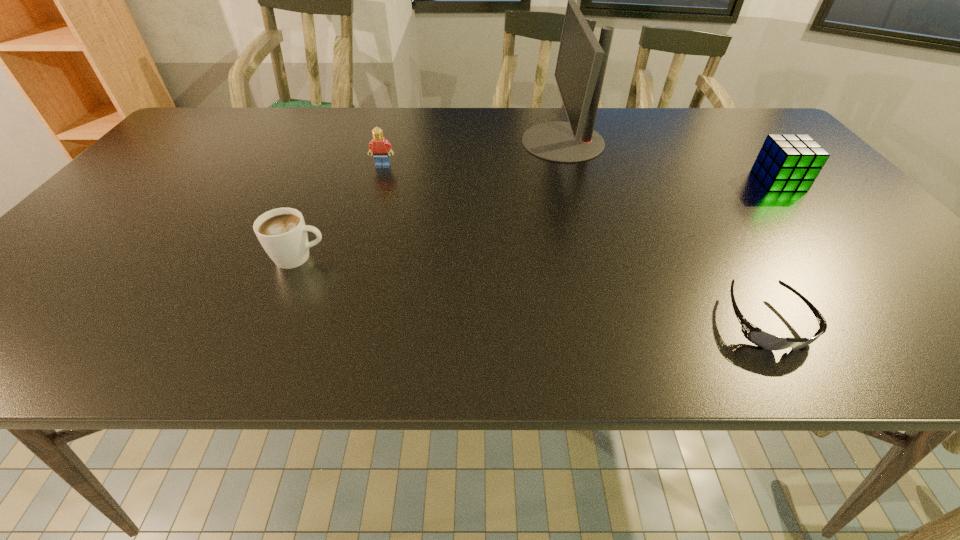
Where is `vacant space at the right edge of the desktop`? vacant space at the right edge of the desktop is located at coordinates (856, 283).

Where is `vacant space at the far left corner of the desktop`? This screenshot has height=540, width=960. vacant space at the far left corner of the desktop is located at coordinates pyautogui.click(x=221, y=132).

In order to click on free space that is in between the computer monitor and the second object from left to right in this screenshot , I will do `click(473, 153)`.

This screenshot has height=540, width=960. Identify the location of free spot between the fourth object from left to right and the second nearest object. (533, 289).

Locate an element on the screen. The image size is (960, 540). empty location between the second object from left to right and the cube is located at coordinates (581, 173).

Find the location of a particular element. This screenshot has width=960, height=540. free point between the shortest object and the computer monitor is located at coordinates (664, 232).

This screenshot has height=540, width=960. I want to click on free space between the leftmost object and the fourth object from right to left, so click(341, 212).

This screenshot has height=540, width=960. I want to click on vacant point located between the rightmost object and the second object from left to right, so click(581, 173).

Where is `empty location between the second object from right to left and the fourth object from right to left`? The height and width of the screenshot is (540, 960). empty location between the second object from right to left and the fourth object from right to left is located at coordinates coord(574,244).

The width and height of the screenshot is (960, 540). Identify the location of vacant point located between the Lego and the rightmost object. (581, 173).